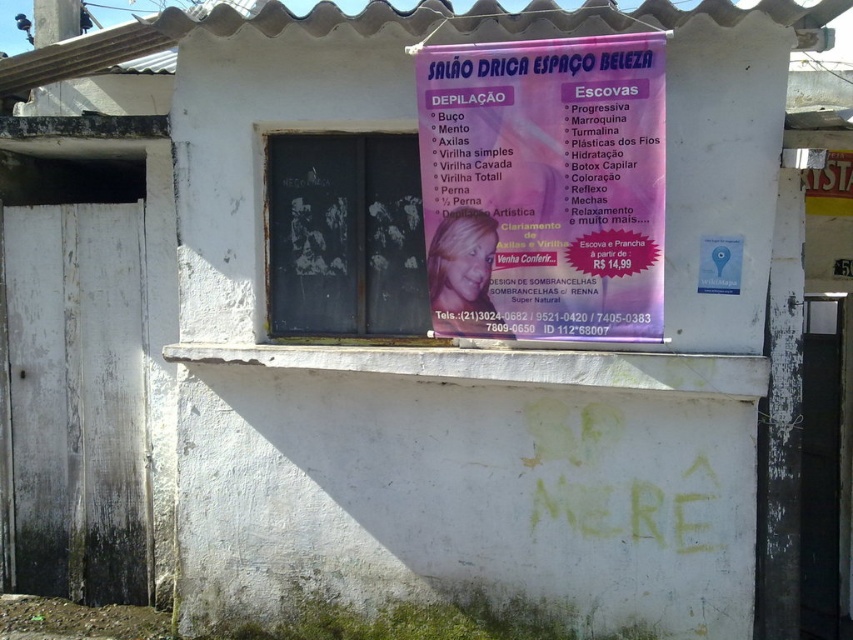
Does point (657, 285) come closer to viewer compared to point (305, 262)?

That is True.

Is point (543, 60) closer to viewer compared to point (294, 192)?

Yes, point (543, 60) is closer to viewer.

Identify the location of pink paper poster at upper center. The width and height of the screenshot is (853, 640). (544, 186).